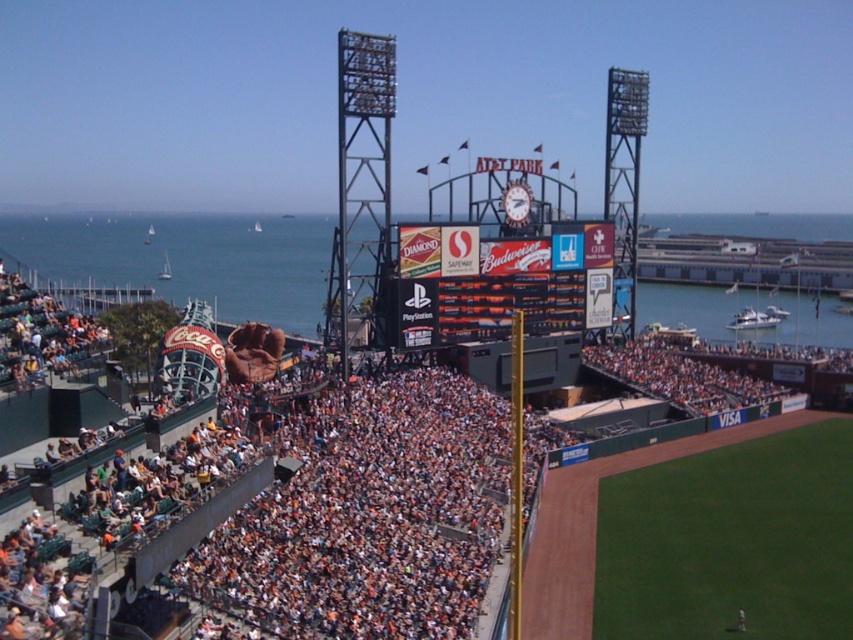
Question: Which of these objects is positioned farthest from the orange fabric crowd at center?

Choices:
 (A) multicolored digital display at center
 (B) blue water at center

Answer: (B)

Question: Which point is farther to the camera?

Choices:
 (A) blue water at center
 (B) orange fabric crowd at center

Answer: (A)

Question: Is orange fabric crowd at center to the right of blue water at center from the viewer's perspective?

Choices:
 (A) no
 (B) yes

Answer: (B)

Question: Considering the relative positions of blue water at center and multicolored digital display at center in the image provided, where is blue water at center located with respect to multicolored digital display at center?

Choices:
 (A) left
 (B) right

Answer: (A)

Question: Can you confirm if orange fabric crowd at center is wider than multicolored digital display at center?

Choices:
 (A) no
 (B) yes

Answer: (B)

Question: Which point appears farthest from the camera in this image?

Choices:
 (A) (416, 545)
 (B) (408, 346)
 (C) (683, 298)

Answer: (C)